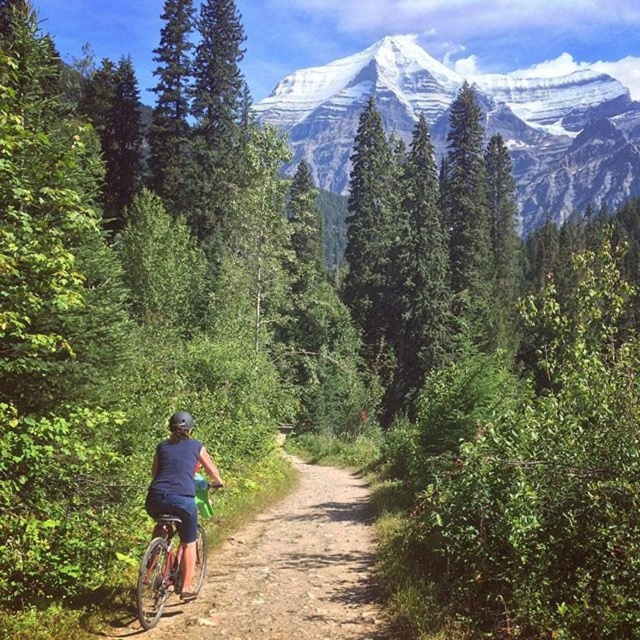
Who is higher up, snowy granite mountain at upper center or blue fabric shorts at lower center?

snowy granite mountain at upper center is above.

Who is shorter, snowy granite mountain at upper center or blue fabric shorts at lower center?

blue fabric shorts at lower center is shorter.

Between point (513, 115) and point (168, 456), which one is positioned behind?

The point (513, 115) is more distant.

At what (x,y) coordinates should I click in order to perform the action: click on snowy granite mountain at upper center. Please return your answer as a coordinate pair (x, y). This screenshot has height=640, width=640. Looking at the image, I should click on (483, 118).

Consider the image. Does metallic silver bicycle at center appear on the left side of matte black helmet at center?

No, metallic silver bicycle at center is not to the left of matte black helmet at center.

Locate an element on the screen. This screenshot has height=640, width=640. metallic silver bicycle at center is located at coordinates (157, 570).

Is point (204, 572) positioned before point (176, 412)?

Yes.

At what (x,y) coordinates should I click in order to perform the action: click on metallic silver bicycle at center. Please return your answer as a coordinate pair (x, y). Image resolution: width=640 pixels, height=640 pixels. Looking at the image, I should click on (157, 570).

What do you see at coordinates (483, 118) in the screenshot? I see `snowy granite mountain at upper center` at bounding box center [483, 118].

Who is positioned more to the right, snowy granite mountain at upper center or matte black helmet at center?

From the viewer's perspective, snowy granite mountain at upper center appears more on the right side.

The image size is (640, 640). What do you see at coordinates (483, 118) in the screenshot?
I see `snowy granite mountain at upper center` at bounding box center [483, 118].

The width and height of the screenshot is (640, 640). In order to click on snowy granite mountain at upper center in this screenshot , I will do point(483,118).